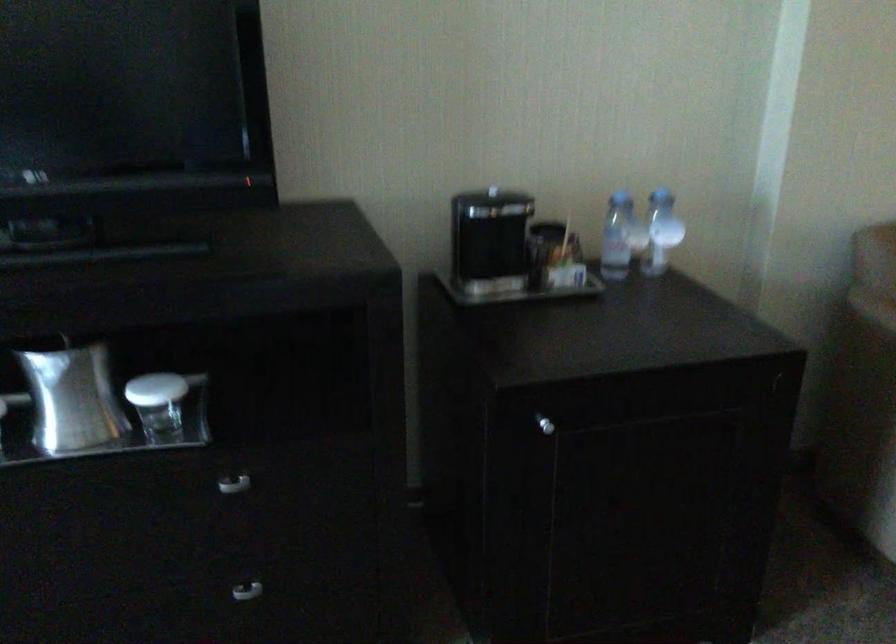
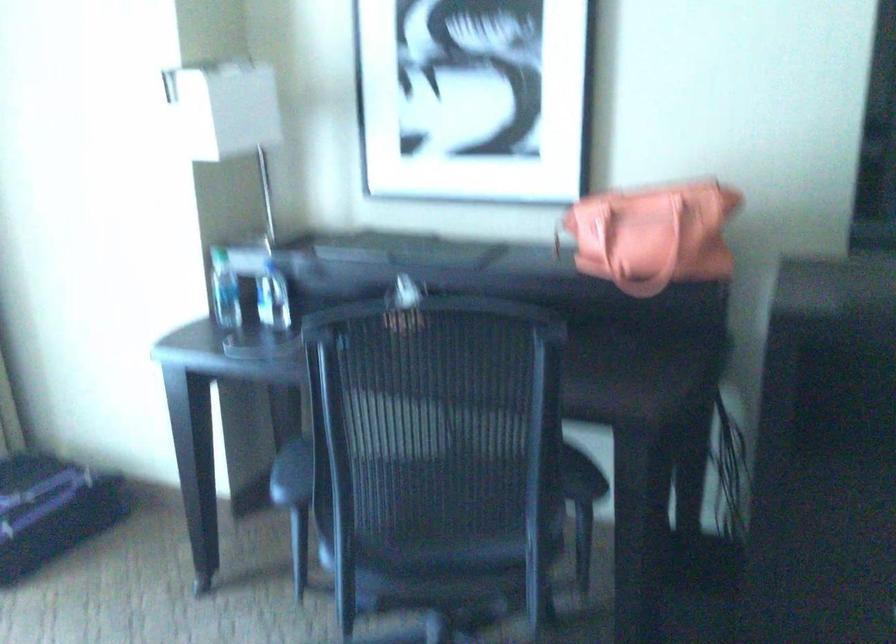
Question: The images are taken continuously from a first-person perspective. In which direction is your viewpoint rotating?

Choices:
 (A) Left
 (B) Right
 (C) Up
 (D) Down

Answer: (A)